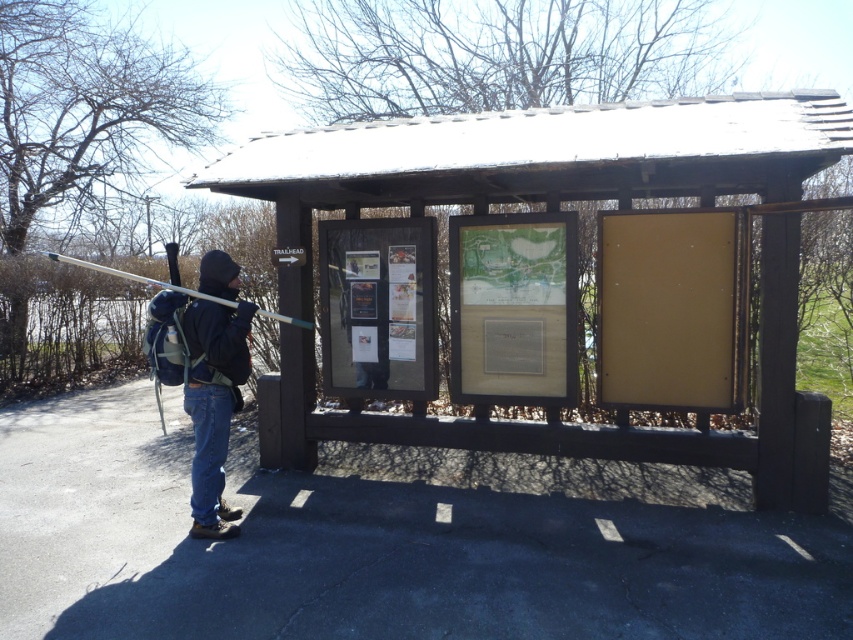
In the scene shown: Does wooden signboard at center have a lesser width compared to black matte jacket at center?

In fact, wooden signboard at center might be wider than black matte jacket at center.

Does wooden signboard at center come in front of black matte jacket at center?

Yes, wooden signboard at center is in front of black matte jacket at center.

The image size is (853, 640). What do you see at coordinates (534, 161) in the screenshot?
I see `wooden signboard at center` at bounding box center [534, 161].

The width and height of the screenshot is (853, 640). In order to click on wooden signboard at center in this screenshot , I will do `click(534, 161)`.

Is point (751, 131) closer to camera compared to point (42, 252)?

That is True.

Is wooden signboard at center closer to the viewer compared to matte white ski pole at left?

Yes, it is.

Is point (747, 161) positioned behind point (56, 253)?

That is False.

Identify the location of wooden signboard at center. Image resolution: width=853 pixels, height=640 pixels. (534, 161).

Is black matte jacket at center thinner than matte white ski pole at left?

Correct, black matte jacket at center's width is less than matte white ski pole at left's.

Between point (227, 333) and point (300, 324), which one is positioned behind?

Point (300, 324)

Identify the location of black matte jacket at center. The image size is (853, 640). (213, 404).